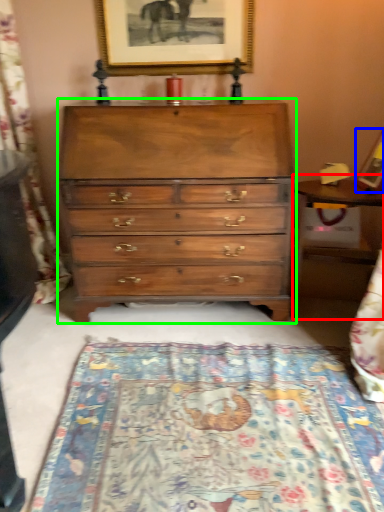
Question: Which object is the farthest from table (highlighted by a red box)? Choose among these: picture frame (highlighted by a blue box) or chest of drawers (highlighted by a green box).

Choices:
 (A) picture frame
 (B) chest of drawers

Answer: (B)